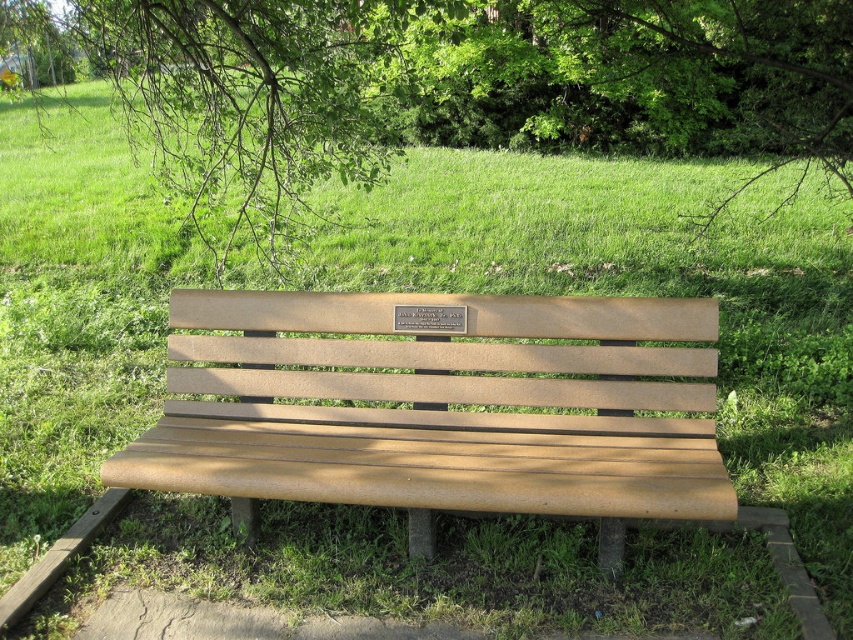
Is green leafy tree at upper center bigger than bronze plaque at center?

Correct, green leafy tree at upper center is larger in size than bronze plaque at center.

Is point (532, 132) more distant than point (444, 321)?

Yes, it is.

Does point (518, 92) come closer to viewer compared to point (440, 317)?

No, it is behind (440, 317).

This screenshot has height=640, width=853. Find the location of `green leafy tree at upper center`. green leafy tree at upper center is located at coordinates (457, 86).

Who is positioned more to the left, green leafy tree at upper center or light brown wood bench at center?

From the viewer's perspective, green leafy tree at upper center appears more on the left side.

Does green leafy tree at upper center have a greater height compared to light brown wood bench at center?

No, green leafy tree at upper center is not taller than light brown wood bench at center.

Based on the photo, who is more distant from viewer, (831, 172) or (332, 454)?

Point (831, 172)

This screenshot has height=640, width=853. What are the coordinates of `green leafy tree at upper center` in the screenshot? It's located at (457, 86).

Is light brown wood bench at center to the right of bronze plaque at center from the viewer's perspective?

No, light brown wood bench at center is not to the right of bronze plaque at center.

Can you confirm if light brown wood bench at center is thinner than bronze plaque at center?

No, light brown wood bench at center is not thinner than bronze plaque at center.

Measure the distance between light brown wood bench at center and camera.

They are 6.65 feet apart.

You are a GUI agent. You are given a task and a screenshot of the screen. Output one action in this format:
    pyautogui.click(x=<x>, y=<y>)
    Task: Click on the light brown wood bench at center
    The height and width of the screenshot is (640, 853).
    Given the screenshot: What is the action you would take?
    pyautogui.click(x=440, y=406)